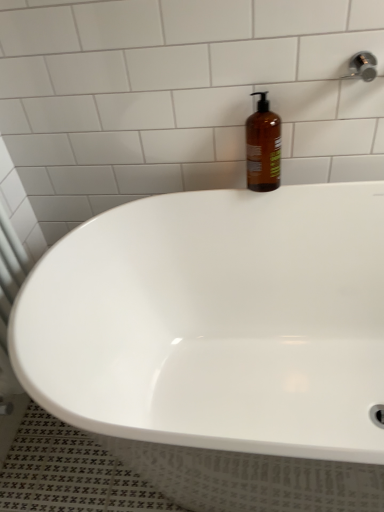
Question: Can you confirm if white glossy bathtub at center is taller than amber glass bottle at upper right?

Choices:
 (A) no
 (B) yes

Answer: (B)

Question: Can you confirm if white glossy bathtub at center is shorter than amber glass bottle at upper right?

Choices:
 (A) yes
 (B) no

Answer: (B)

Question: Considering the relative sizes of white glossy bathtub at center and amber glass bottle at upper right in the image provided, is white glossy bathtub at center wider than amber glass bottle at upper right?

Choices:
 (A) no
 (B) yes

Answer: (B)

Question: From a real-world perspective, is white glossy bathtub at center physically below amber glass bottle at upper right?

Choices:
 (A) no
 (B) yes

Answer: (B)

Question: From a real-world perspective, is white glossy bathtub at center over amber glass bottle at upper right?

Choices:
 (A) yes
 (B) no

Answer: (B)

Question: Could you tell me if white glossy bathtub at center is turned towards amber glass bottle at upper right?

Choices:
 (A) yes
 (B) no

Answer: (B)

Question: From the image's perspective, is amber glass bottle at upper right beneath white glossy bathtub at center?

Choices:
 (A) yes
 (B) no

Answer: (B)

Question: Considering the relative sizes of amber glass bottle at upper right and white glossy bathtub at center in the image provided, is amber glass bottle at upper right taller than white glossy bathtub at center?

Choices:
 (A) no
 (B) yes

Answer: (A)

Question: Does amber glass bottle at upper right have a lesser width compared to white glossy bathtub at center?

Choices:
 (A) no
 (B) yes

Answer: (B)

Question: Is amber glass bottle at upper right with white glossy bathtub at center?

Choices:
 (A) no
 (B) yes

Answer: (A)

Question: Is amber glass bottle at upper right to the right of white glossy bathtub at center from the viewer's perspective?

Choices:
 (A) no
 (B) yes

Answer: (B)

Question: Would you consider amber glass bottle at upper right to be distant from white glossy bathtub at center?

Choices:
 (A) no
 (B) yes

Answer: (A)

Question: From the image's perspective, is amber glass bottle at upper right located above or below white glossy bathtub at center?

Choices:
 (A) above
 (B) below

Answer: (A)